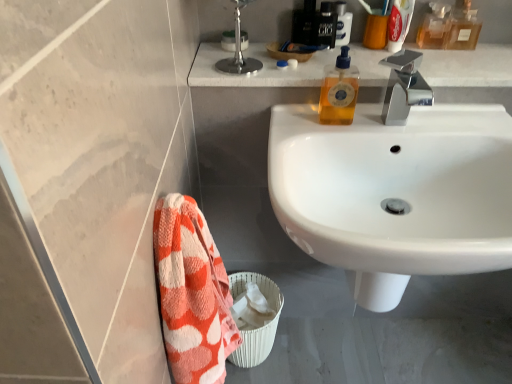
Question: In terms of width, does polished chrome faucet at upper right look wider or thinner when compared to translucent amber liquid at upper right, which is counted as the 3th mouthwash, starting from the left?

Choices:
 (A) wide
 (B) thin

Answer: (A)

Question: In the image, is polished chrome faucet at upper right positioned in front of or behind translucent amber liquid at upper right, which is counted as the 3th mouthwash, starting from the left?

Choices:
 (A) front
 (B) behind

Answer: (A)

Question: Which object is the farthest from the yellow liquid soap at upper right, acting as the 1th toiletry starting from the bottom?

Choices:
 (A) polished chrome faucet at upper right
 (B) white marble countertop at upper center
 (C) white plastic toothpaste tube at upper right, the third mouthwash in the right-to-left sequence
 (D) polished chrome faucet at upper right
 (E) translucent plastic mouthwash at upper center, marked as the 1th mouthwash in a left-to-right arrangement

Answer: (C)

Question: Considering the real-world distances, which object is closest to the translucent amber liquid at upper right, which is counted as the 3th mouthwash, starting from the left?

Choices:
 (A) orange cotton towel at lower left
 (B) transparent glass bottle at upper right, acting as the fourth mouthwash starting from the left
 (C) translucent plastic mouthwash at upper center, the 4th mouthwash positioned from the right
 (D) polished chrome faucet at upper right
 (E) white marble countertop at upper center

Answer: (B)